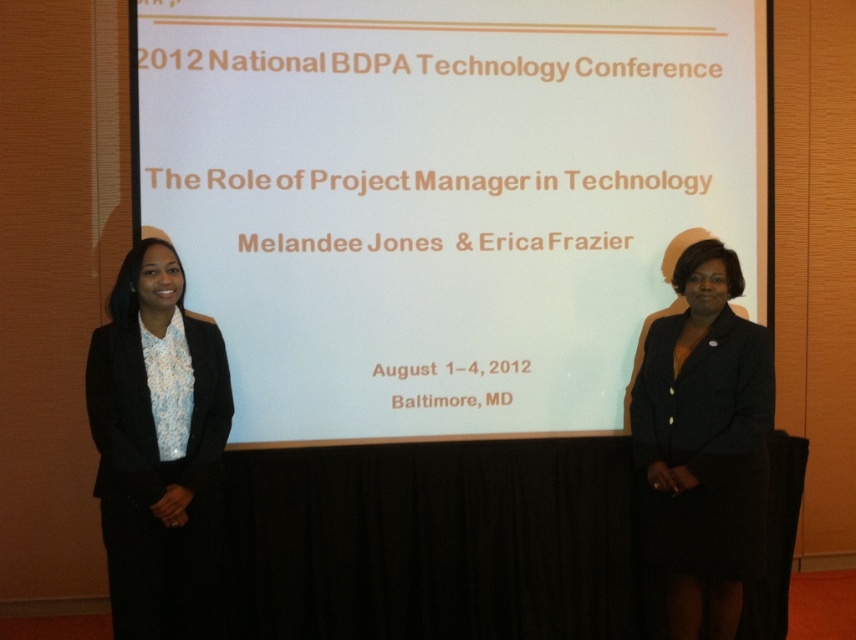
Question: Among these points, which one is farthest from the camera?

Choices:
 (A) (188, 625)
 (B) (682, 352)
 (C) (642, 333)

Answer: (C)

Question: Which is nearer to the white matte projection screen at center?

Choices:
 (A) black satin blazer at left
 (B) black fabric skirt at right

Answer: (B)

Question: Is white matte projection screen at center to the left of black fabric skirt at right from the viewer's perspective?

Choices:
 (A) yes
 (B) no

Answer: (A)

Question: Does white matte projection screen at center come in front of black satin blazer at left?

Choices:
 (A) no
 (B) yes

Answer: (A)

Question: Is black satin blazer at left behind black fabric skirt at right?

Choices:
 (A) no
 (B) yes

Answer: (A)

Question: Which point is closer to the camera?

Choices:
 (A) white matte projection screen at center
 (B) black fabric skirt at right

Answer: (B)